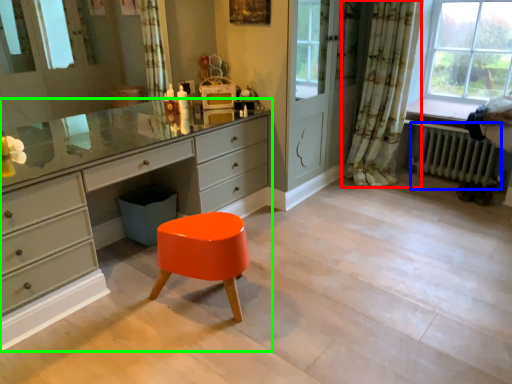
Question: Considering the real-world distances, which object is farthest from curtain (highlighted by a red box)? radiator (highlighted by a blue box) or chest of drawers (highlighted by a green box)?

Choices:
 (A) radiator
 (B) chest of drawers

Answer: (B)